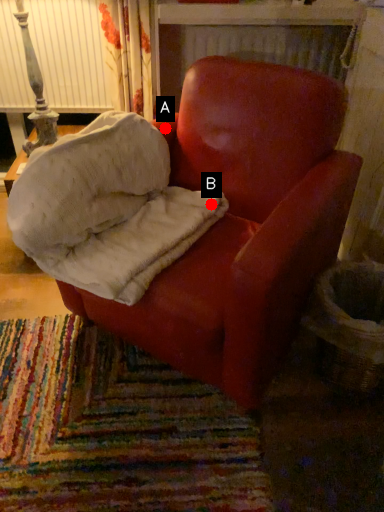
Question: Two points are circled on the image, labeled by A and B beside each circle. Which point is farther to the camera?

Choices:
 (A) A is further
 (B) B is further

Answer: (A)